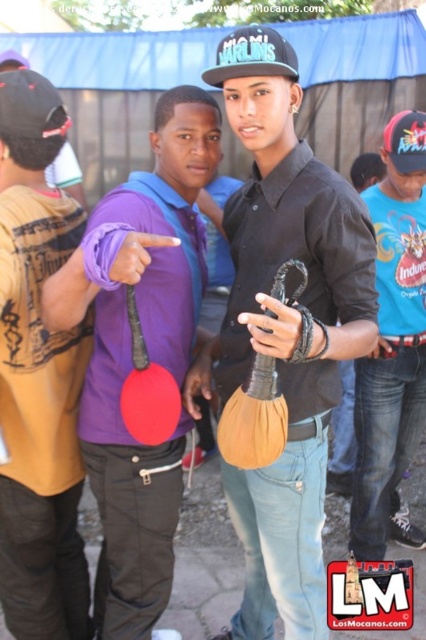
Question: Can you confirm if matte black shirt at center is positioned above black matte baseball cap at center?

Choices:
 (A) yes
 (B) no

Answer: (B)

Question: Where is matte black shirt at center located in relation to black matte baseball cap at center in the image?

Choices:
 (A) right
 (B) left

Answer: (A)

Question: Which of the following is the farthest from the observer?

Choices:
 (A) (222, 84)
 (B) (219, 74)
 (C) (405, 332)

Answer: (C)

Question: Which object is positioned closest to the blue cotton shirt at right?

Choices:
 (A) black matte baseball cap at center
 (B) matte black shirt at center

Answer: (B)

Question: Which point is closer to the camera taking this photo?

Choices:
 (A) (233, 68)
 (B) (409, 458)

Answer: (A)

Question: Can you confirm if blue cotton shirt at right is positioned below black matte baseball cap at center?

Choices:
 (A) no
 (B) yes

Answer: (B)